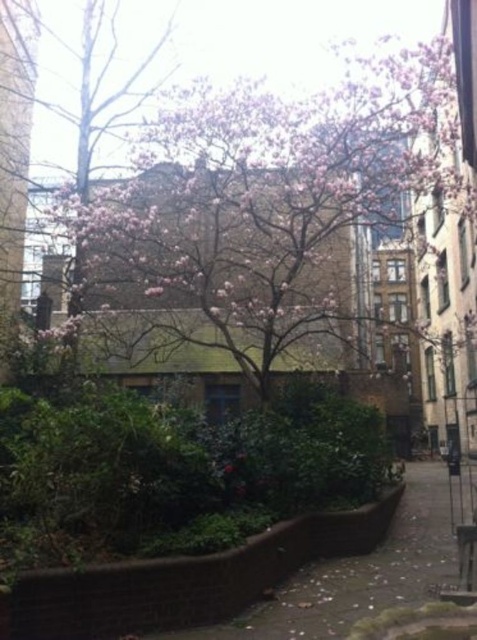
Question: Among these objects, which one is farthest from the camera?

Choices:
 (A) pink bloom tree at center
 (B) brown concrete pavement at lower center

Answer: (A)

Question: Is pink bloom tree at center smaller than brown concrete pavement at lower center?

Choices:
 (A) yes
 (B) no

Answer: (B)

Question: Does pink bloom tree at center lie behind brown concrete pavement at lower center?

Choices:
 (A) no
 (B) yes

Answer: (B)

Question: Is pink bloom tree at center above brown concrete pavement at lower center?

Choices:
 (A) yes
 (B) no

Answer: (A)

Question: Among these objects, which one is nearest to the camera?

Choices:
 (A) pink bloom tree at center
 (B) brown concrete pavement at lower center

Answer: (B)